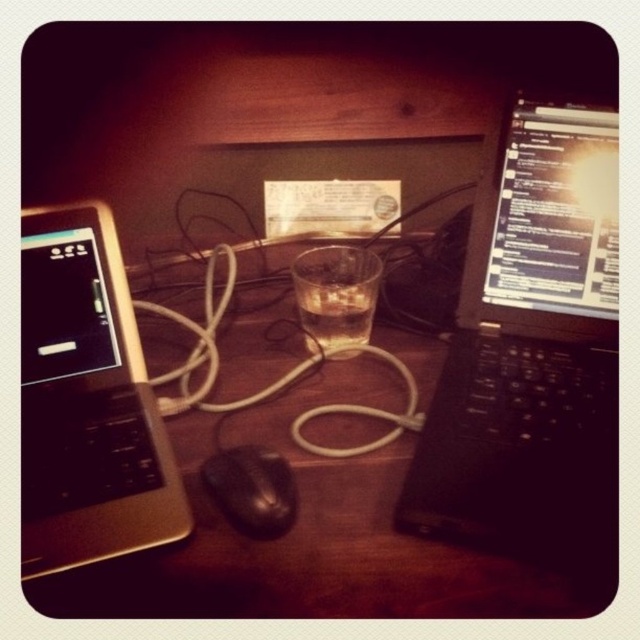
Is point (237, 429) closer to camera compared to point (593, 442)?

That is False.

Is wooden desk at center to the right of black matte laptop at right from the viewer's perspective?

No, wooden desk at center is not to the right of black matte laptop at right.

Is point (333, 420) behind point (566, 387)?

Yes, point (333, 420) is farther from viewer.

Image resolution: width=640 pixels, height=640 pixels. I want to click on wooden desk at center, so click(332, 536).

Can you confirm if black matte laptop at right is positioned above black matte mouse at center?

Yes, black matte laptop at right is above black matte mouse at center.

Can you confirm if black matte laptop at right is positioned below black matte mouse at center?

No.

This screenshot has width=640, height=640. In order to click on black matte laptop at right in this screenshot , I will do `click(529, 356)`.

Which is above, black matte laptop at right or silver metallic laptop at left?

black matte laptop at right

Between black matte laptop at right and silver metallic laptop at left, which one has more height?

black matte laptop at right is taller.

Is point (480, 461) closer to camera compared to point (148, 493)?

That is False.

Where is `black matte laptop at right`? black matte laptop at right is located at coordinates (529, 356).